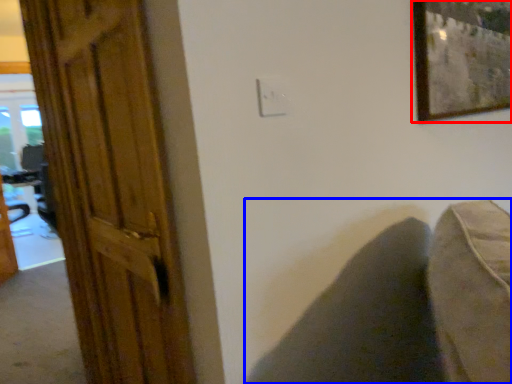
Question: Which of the following is the closest to the observer, picture frame (highlighted by a red box) or swivel chair (highlighted by a blue box)?

Choices:
 (A) picture frame
 (B) swivel chair

Answer: (A)